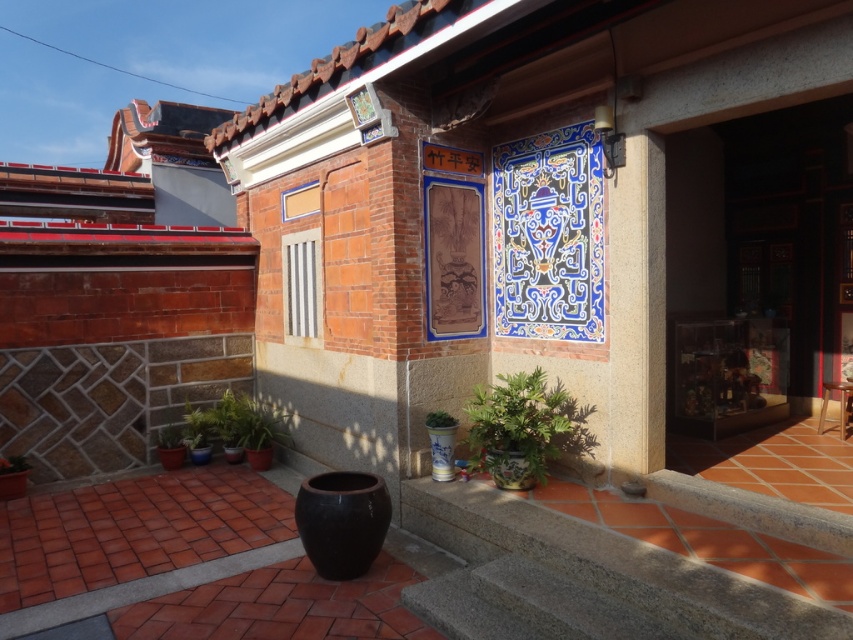
Who is more distant from viewer, [781,308] or [582,420]?

Point [781,308]

In the scene shown: Can you confirm if wooden door at center is positioned to the left of green glossy plant at lower center?

In fact, wooden door at center is to the right of green glossy plant at lower center.

Locate an element on the screen. This screenshot has height=640, width=853. wooden door at center is located at coordinates click(x=757, y=266).

Can you confirm if wooden door at center is positioned to the right of green glossy plant at lower left?

Indeed, wooden door at center is positioned on the right side of green glossy plant at lower left.

Between wooden door at center and green glossy plant at lower left, which one is positioned higher?

wooden door at center

What do you see at coordinates (757, 266) in the screenshot?
I see `wooden door at center` at bounding box center [757, 266].

This screenshot has height=640, width=853. What are the coordinates of `wooden door at center` in the screenshot? It's located at (757, 266).

Does green glossy plant at lower center have a lesser height compared to green glossy plant at lower left?

Incorrect, green glossy plant at lower center's height does not fall short of green glossy plant at lower left's.

Who is positioned more to the right, green glossy plant at lower center or green glossy plant at lower left?

From the viewer's perspective, green glossy plant at lower center appears more on the right side.

Measure the distance between point (x=553, y=451) and camera.

Point (x=553, y=451) is 14.45 feet away from camera.

Identify the location of green glossy plant at lower center. (523, 428).